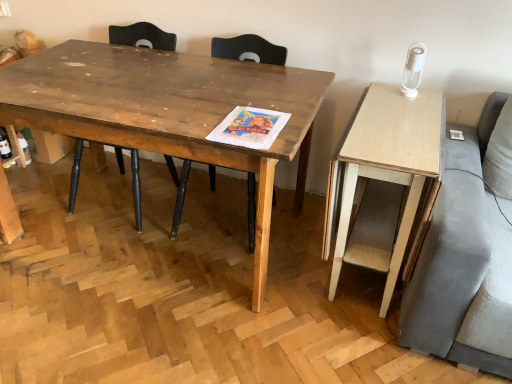
Question: In terms of size, does wooden chair at center, arranged as the 2th chair when viewed from the left, appear bigger or smaller than wooden chair at center, marked as the 1th chair in a left-to-right arrangement?

Choices:
 (A) big
 (B) small

Answer: (B)

Question: Is wooden chair at center, marked as the first chair in a right-to-left arrangement, to the left or to the right of wooden chair at center, which appears as the second chair when viewed from the right, in the image?

Choices:
 (A) left
 (B) right

Answer: (B)

Question: Which of these objects is positioned farthest from the wooden chair at center, marked as the 1th chair in a left-to-right arrangement?

Choices:
 (A) wooden table at center
 (B) wooden chair at center, marked as the first chair in a right-to-left arrangement
 (C) light wood desk at right

Answer: (C)

Question: Which of these objects is positioned farthest from the wooden chair at center, arranged as the 2th chair when viewed from the left?

Choices:
 (A) light wood desk at right
 (B) wooden table at center
 (C) wooden chair at center, which appears as the second chair when viewed from the right

Answer: (A)